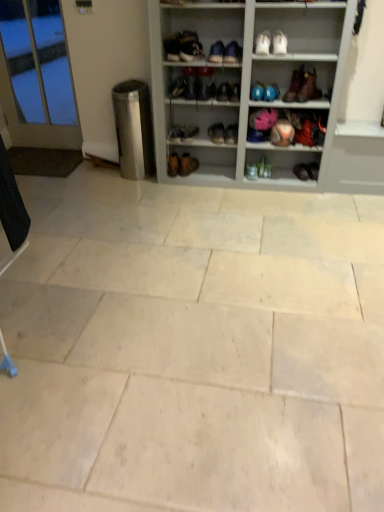
Find the location of a particular element. This screenshot has height=512, width=384. free spot below leather boot at center, acting as the eighth footwear starting from the right (from a real-world perspective) is located at coordinates (223, 169).